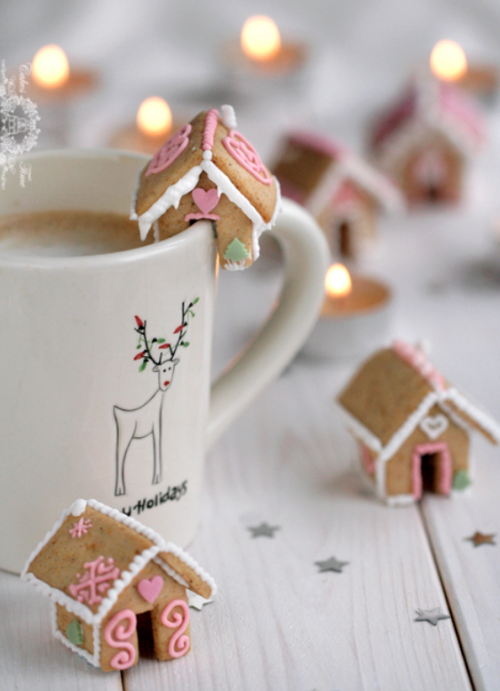
Locate an element on the screen. 4 decorative stars is located at coordinates (266, 527), (330, 567), (427, 616), (476, 539).